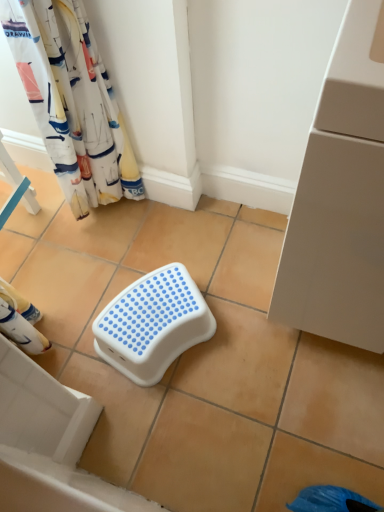
This screenshot has width=384, height=512. Identify the location of vacant space in front of white fabric curtain at upper left. (115, 248).